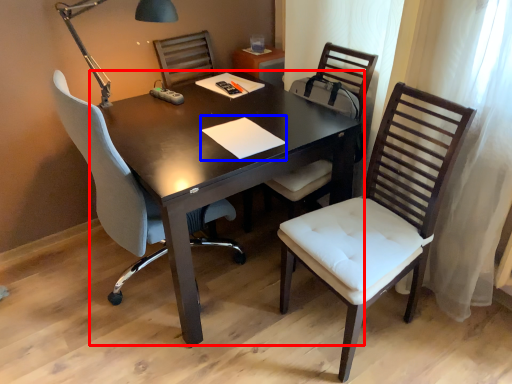
Question: Among these objects, which one is farthest to the camera, table (highlighted by a red box) or notepad (highlighted by a blue box)?

Choices:
 (A) table
 (B) notepad

Answer: (B)